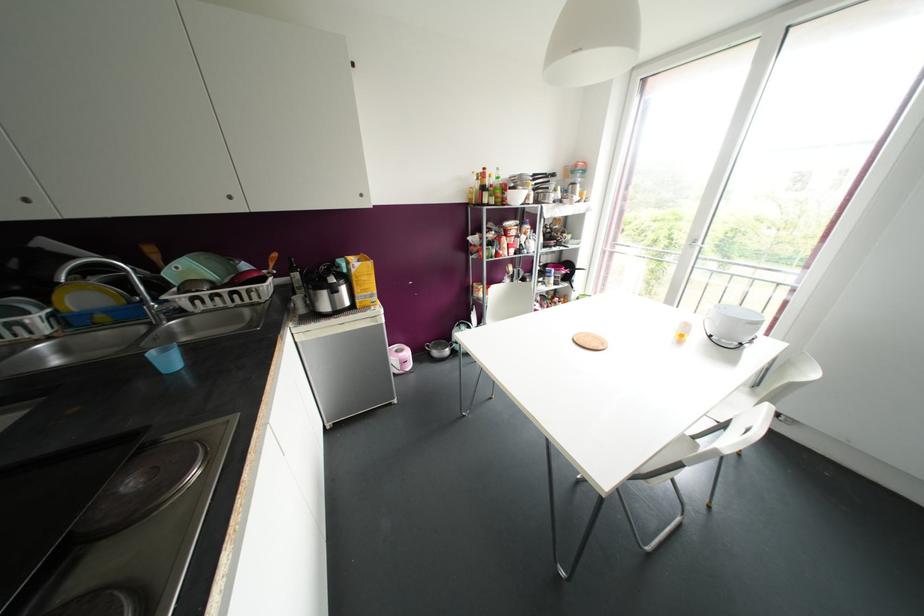
Where would you lift the large yellow box? Please return your answer as a coordinate pair (x, y).

(361, 280)